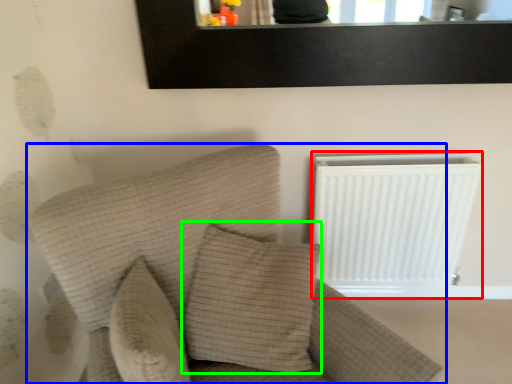
Question: Considering the real-world distances, which object is farthest from radiator (highlighted by a red box)? furniture (highlighted by a blue box) or pillow (highlighted by a green box)?

Choices:
 (A) furniture
 (B) pillow

Answer: (A)